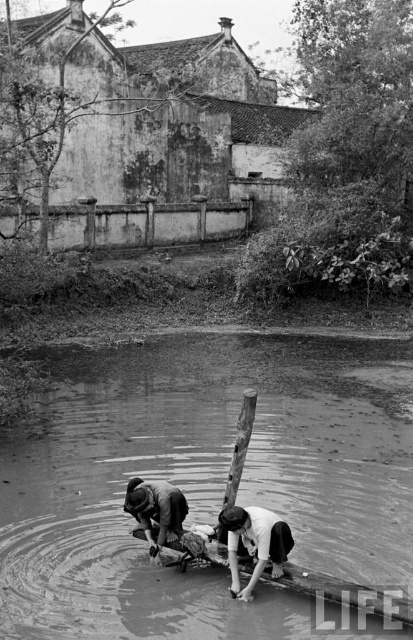
Question: Considering the real-world distances, which object is farthest from the smooth white shirt at lower center?

Choices:
 (A) smooth water at center
 (B) dark gray fabric at lower center

Answer: (A)

Question: Can you confirm if smooth water at center is positioned above smooth white shirt at lower center?

Choices:
 (A) yes
 (B) no

Answer: (A)

Question: Which point appears closest to the camera in this image?

Choices:
 (A) (165, 508)
 (B) (261, 484)

Answer: (A)

Question: Does smooth white shirt at lower center appear over dark gray fabric at lower center?

Choices:
 (A) yes
 (B) no

Answer: (B)

Question: Which point is closer to the camera?

Choices:
 (A) (258, 532)
 (B) (401, 624)
 (C) (163, 508)
 (D) (30, 509)

Answer: (B)

Question: Does smooth white shirt at lower center appear over dark gray fabric at lower center?

Choices:
 (A) no
 (B) yes

Answer: (A)